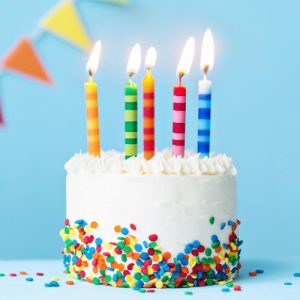
The height and width of the screenshot is (300, 300). Find the location of `birthday candles`. birthday candles is located at coordinates point(94,145), point(131,145), point(151,147), point(176,144), point(203,147).